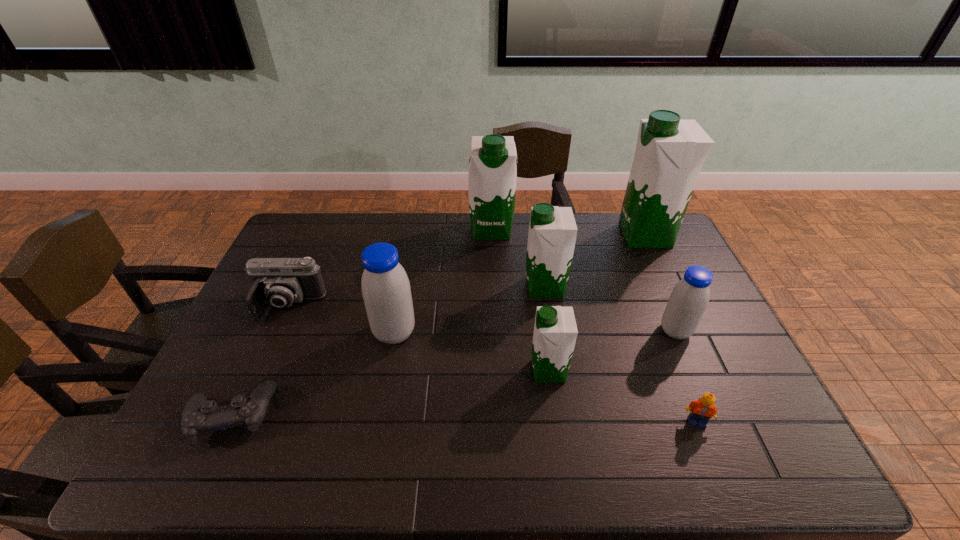
The width and height of the screenshot is (960, 540). In order to click on the fourth closest object to the eighth tallest object in this screenshot , I will do `click(670, 152)`.

Where is `soya milk that stands as the fourth closest to the third biggest green soya milk`? The width and height of the screenshot is (960, 540). soya milk that stands as the fourth closest to the third biggest green soya milk is located at coordinates (670, 152).

You are a GUI agent. You are given a task and a screenshot of the screen. Output one action in this format:
    pyautogui.click(x=<x>, y=<y>)
    Task: Click on the soya milk that is the fifth closest to the tallest soya milk
    The width and height of the screenshot is (960, 540).
    Given the screenshot: What is the action you would take?
    pyautogui.click(x=386, y=291)

Identify which green soya milk is the fourth closest to the orange Lego. Please provide its 2D coordinates. Your answer should be formatted as a tuple, i.e. [(x, y)], where the tuple contains the x and y coordinates of a point satisfying the conditions above.

[(492, 172)]

Identify the location of green soya milk identified as the second closest to the smallest green soya milk. The height and width of the screenshot is (540, 960). (492, 172).

Image resolution: width=960 pixels, height=540 pixels. Identify the location of free space that satisfies the following two spatial constraints: 1. on the front-facing side of the tallest object; 2. on the front-facing side of the orange Lego. (732, 422).

Where is `free spot that satisfies the following two spatial constraints: 1. at the front of the camera with an open lens cover; 2. on the right side of the smaller blue soya milk`? The height and width of the screenshot is (540, 960). free spot that satisfies the following two spatial constraints: 1. at the front of the camera with an open lens cover; 2. on the right side of the smaller blue soya milk is located at coordinates (276, 331).

At what (x,y) coordinates should I click in order to perform the action: click on vacant space that satisfies the following two spatial constraints: 1. on the front-facing side of the third biggest green soya milk; 2. at the front of the third shortest object with an open lens cover. Please return your answer as a coordinate pair (x, y). Looking at the image, I should click on (548, 307).

This screenshot has height=540, width=960. I want to click on vacant region that satisfies the following two spatial constraints: 1. on the front-facing side of the tallest soya milk; 2. at the front of the third shortest object with an open lens cover, so click(679, 307).

At what (x,y) coordinates should I click in order to perform the action: click on free space that satisfies the following two spatial constraints: 1. on the back side of the shortest object; 2. on the right side of the bigger blue soya milk. Please return your answer as a coordinate pair (x, y). Looking at the image, I should click on coord(269,333).